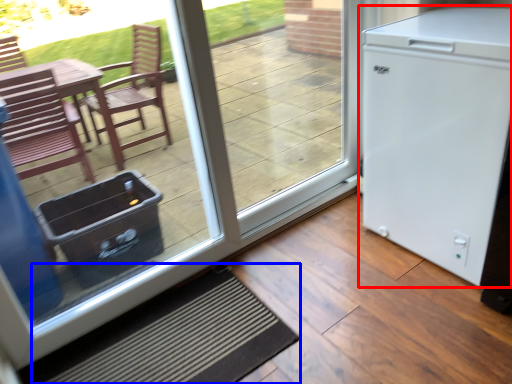
Question: Which point is further to the camera, refrigerator (highlighted by a red box) or doormat (highlighted by a blue box)?

Choices:
 (A) refrigerator
 (B) doormat

Answer: (A)